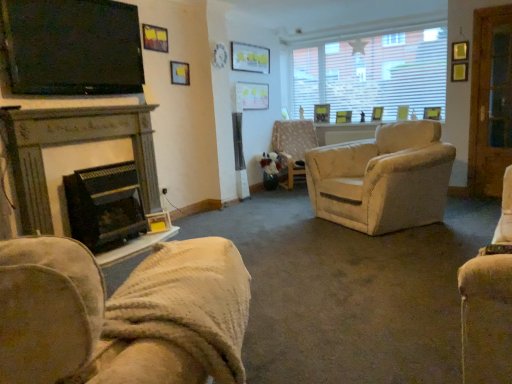
Question: Is matte white picture frame at upper center at the left side of white textured window at upper right?

Choices:
 (A) no
 (B) yes

Answer: (B)

Question: Is the depth of matte white picture frame at upper center greater than that of white textured window at upper right?

Choices:
 (A) yes
 (B) no

Answer: (B)

Question: Can we say matte white picture frame at upper center lies outside white textured window at upper right?

Choices:
 (A) no
 (B) yes

Answer: (B)

Question: From a real-world perspective, does matte white picture frame at upper center stand above white textured window at upper right?

Choices:
 (A) yes
 (B) no

Answer: (A)

Question: Is matte white picture frame at upper center taller than white textured window at upper right?

Choices:
 (A) no
 (B) yes

Answer: (A)

Question: Relative to matte black tv at upper left, is wooden screen door at right in front or behind?

Choices:
 (A) front
 (B) behind

Answer: (B)

Question: Is wooden screen door at right situated inside matte black tv at upper left or outside?

Choices:
 (A) outside
 (B) inside

Answer: (A)

Question: From the image's perspective, is wooden screen door at right positioned above or below matte black tv at upper left?

Choices:
 (A) below
 (B) above

Answer: (A)

Question: Is point (468, 190) positioned closer to the camera than point (110, 66)?

Choices:
 (A) closer
 (B) farther

Answer: (B)

Question: Is beige fabric chair at center, acting as the 2th chair starting from the left, wider or thinner than wooden screen door at right?

Choices:
 (A) wide
 (B) thin

Answer: (A)

Question: Is beige fabric chair at center, the 1th chair positioned from the right, in front of or behind wooden screen door at right in the image?

Choices:
 (A) behind
 (B) front

Answer: (A)

Question: Considering the positions of beige fabric chair at center, which is counted as the 1th chair, starting from the top, and wooden screen door at right in the image, is beige fabric chair at center, which is counted as the 1th chair, starting from the top, taller or shorter than wooden screen door at right?

Choices:
 (A) tall
 (B) short

Answer: (B)

Question: Would you say beige fabric chair at center, acting as the 2th chair starting from the left, is to the left or to the right of wooden screen door at right in the picture?

Choices:
 (A) left
 (B) right

Answer: (A)

Question: Considering their positions, is dark gray stone fireplace at left, which appears as the second fireplace when ordered from the bottom, located in front of or behind beige fabric chair at center, the second chair in the front-to-back sequence?

Choices:
 (A) behind
 (B) front

Answer: (B)

Question: Considering the positions of point (25, 203) and point (285, 129), is point (25, 203) closer or farther from the camera than point (285, 129)?

Choices:
 (A) farther
 (B) closer

Answer: (B)